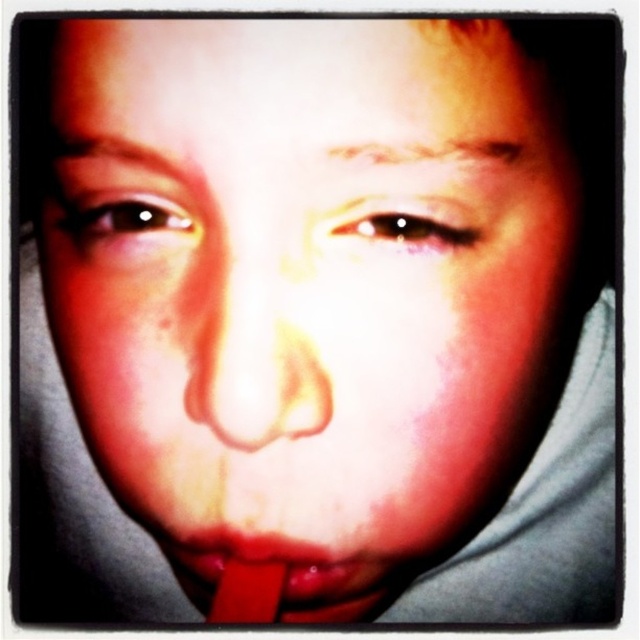
Question: Which point is farther to the camera?

Choices:
 (A) brown glossy eye at upper left
 (B) smooth flesh nose at center
 (C) shiny brown eye at center

Answer: (A)

Question: Is rubber-like red at center to the right of shiny brown eye at center from the viewer's perspective?

Choices:
 (A) yes
 (B) no

Answer: (B)

Question: Does smooth flesh nose at center have a larger size compared to rubber-like red at center?

Choices:
 (A) yes
 (B) no

Answer: (B)

Question: Which point is farther to the camera?

Choices:
 (A) (291, 554)
 (B) (330, 232)

Answer: (A)

Question: Which object appears farthest from the camera in this image?

Choices:
 (A) brown glossy eye at upper left
 (B) shiny brown eye at center

Answer: (A)

Question: Does rubber-like red at center appear under brown glossy eye at upper left?

Choices:
 (A) yes
 (B) no

Answer: (A)